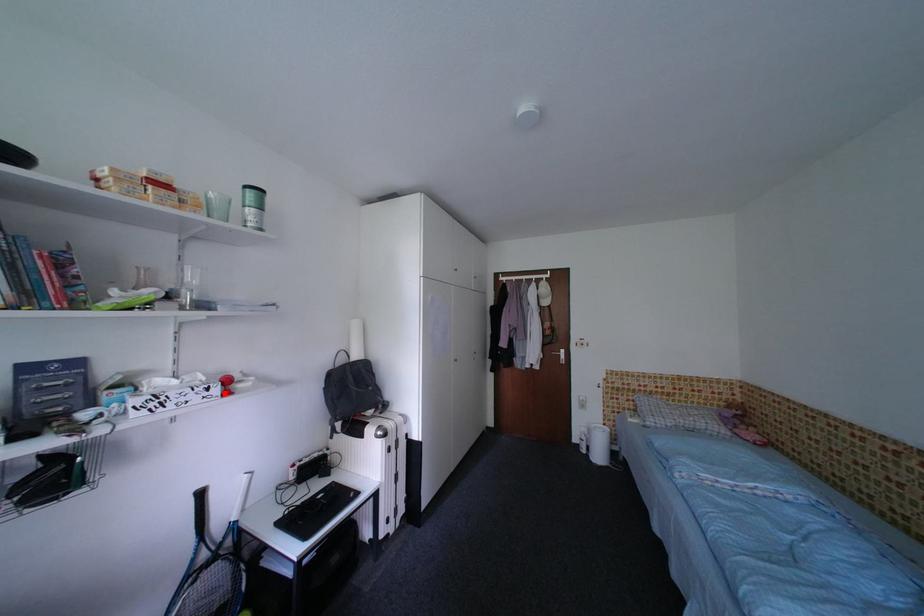
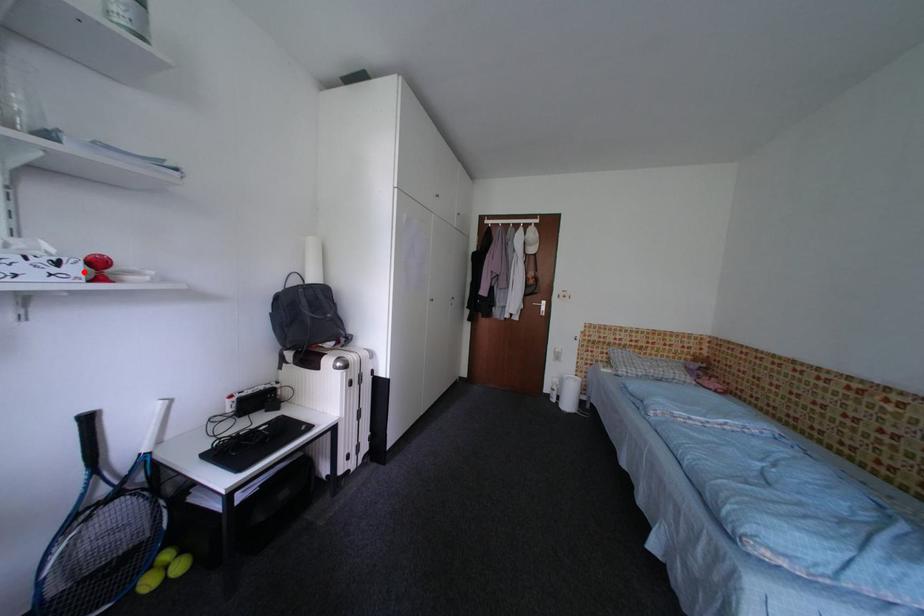
I am providing you with two images of the same scene from different viewpoints. A red point is marked on the first image and another point is marked on the second image. Is the marked point in image1 the same physical position as the marked point in image2?

Yes